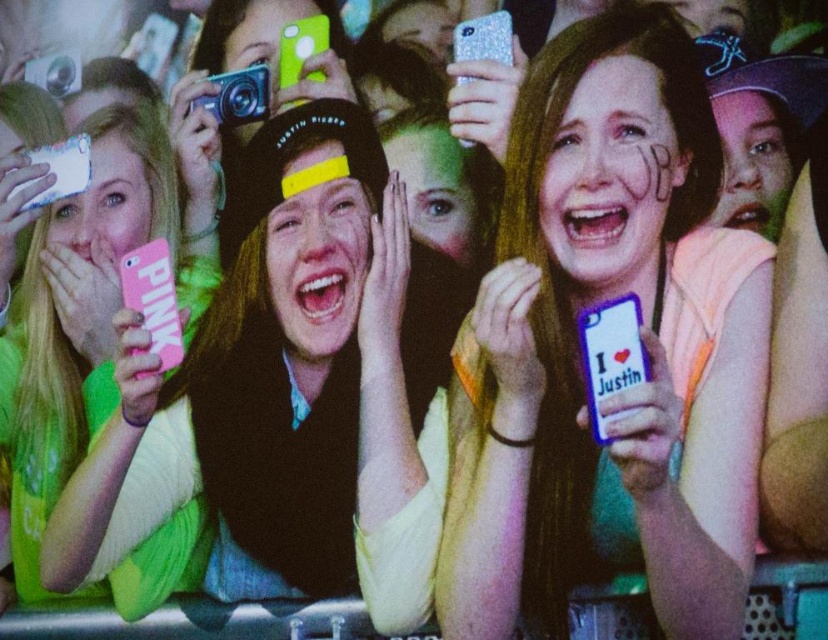
You are a photographer at the event and want to capture both the pink matte phone at center and the pink matte phone at left in a single photo. However, you can only focus on one phone at a time. Which phone should you focus on to ensure the other is still visible in the background?

You should focus on the pink matte phone at center because it is in front of the pink matte phone at left, so the latter will naturally appear in the background.